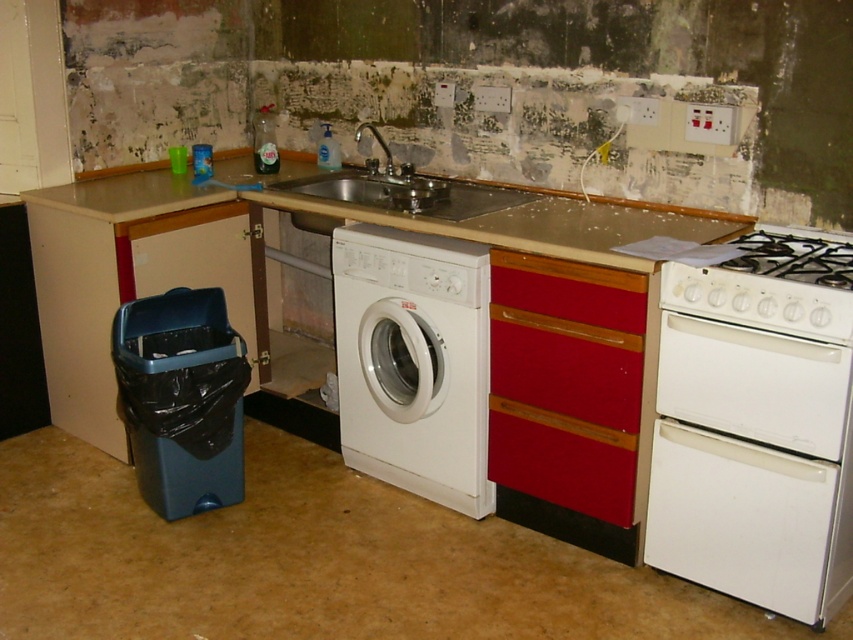
Question: Can you confirm if metallic sink at center is smaller than brushed metal faucet at upper center?

Choices:
 (A) yes
 (B) no

Answer: (B)

Question: In this image, where is white matte washing machine at center located relative to red matte drawer at center?

Choices:
 (A) left
 (B) right

Answer: (A)

Question: Which point is closer to the camera?

Choices:
 (A) (524, 456)
 (B) (740, 294)
 (C) (817, 257)
 (D) (386, 173)

Answer: (B)

Question: Is white glossy oven at lower right closer to camera compared to metallic sink at center?

Choices:
 (A) yes
 (B) no

Answer: (A)

Question: Which point is farther to the camera?

Choices:
 (A) (634, 358)
 (B) (633, 476)

Answer: (B)

Question: Which point is farther to the camera?

Choices:
 (A) red wood drawer at center
 (B) matte red drawer at center
 (C) brushed metal faucet at upper center

Answer: (C)